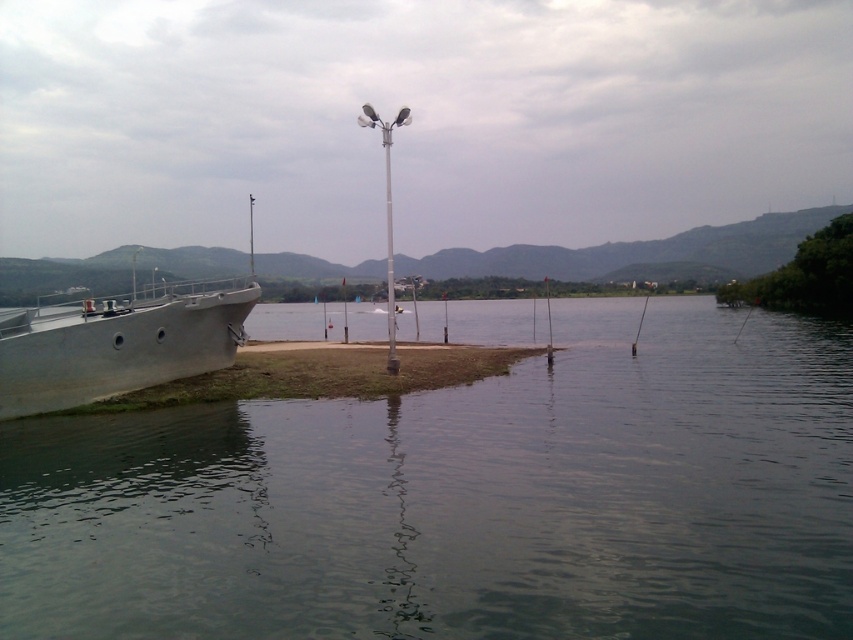
You are standing at the lakeside and want to know how far the point at coordinates point (222, 323) is from you. Can you determine the distance?

The distance of point (222, 323) from viewer is 22.58 meters.

Consider the image. You are standing at the point with coordinates point (386, 179) and want to look towards the point with coordinates point (165, 378). Which direction should you face?

You should face forward because point (165, 378) is in front of point (386, 179).

You are standing on the dock and see the greenish water at lower left and the white plastic pole at center. Which object is closer to your right side?

The greenish water at lower left is positioned on the right side of white plastic pole at center, so the greenish water at lower left is closer to your right side.